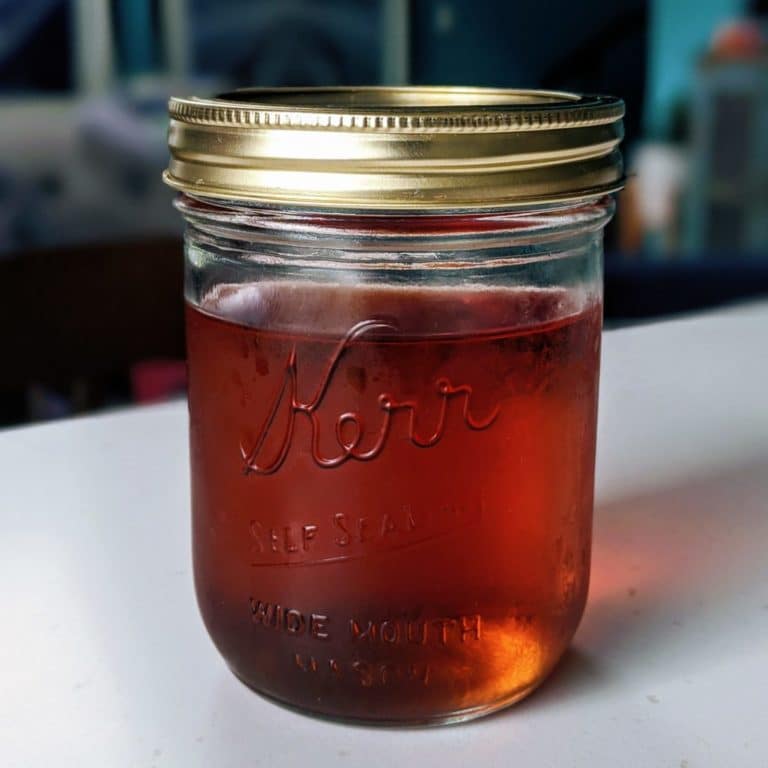
Where is `mason jar`? Image resolution: width=768 pixels, height=768 pixels. mason jar is located at coordinates point(458,338).